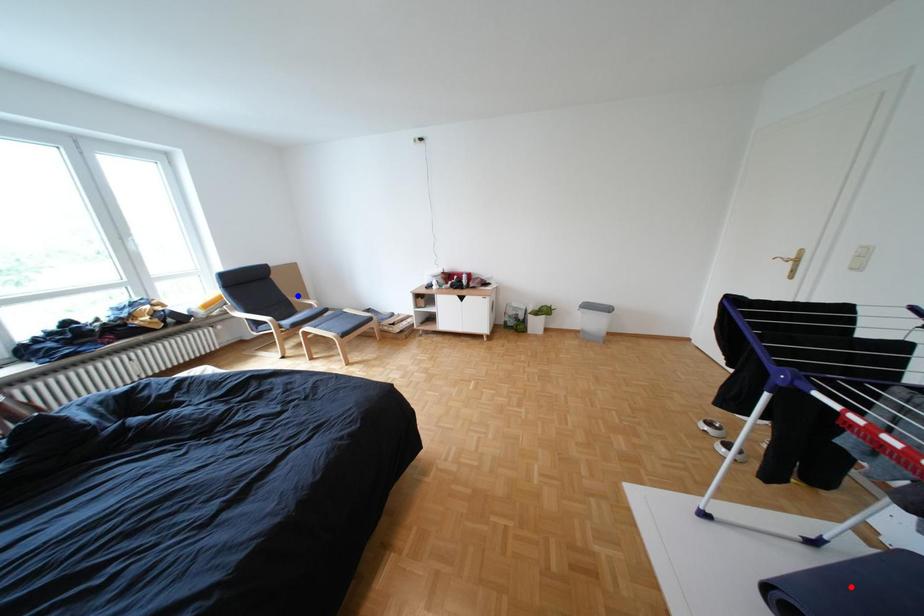
Question: In the image, two points are highlighted. Which point is nearer to the camera? Reply with the corresponding letter.

Choices:
 (A) blue point
 (B) red point

Answer: (B)